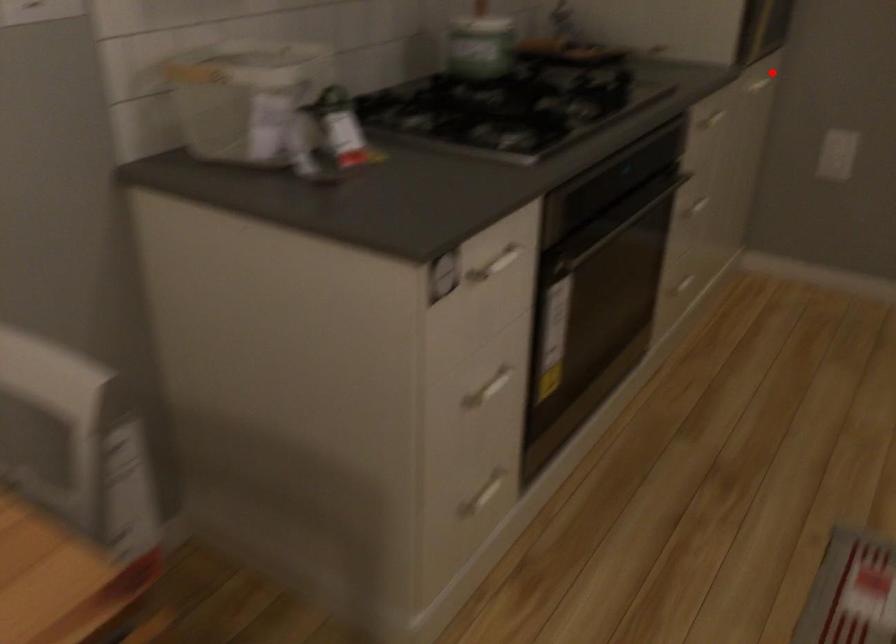
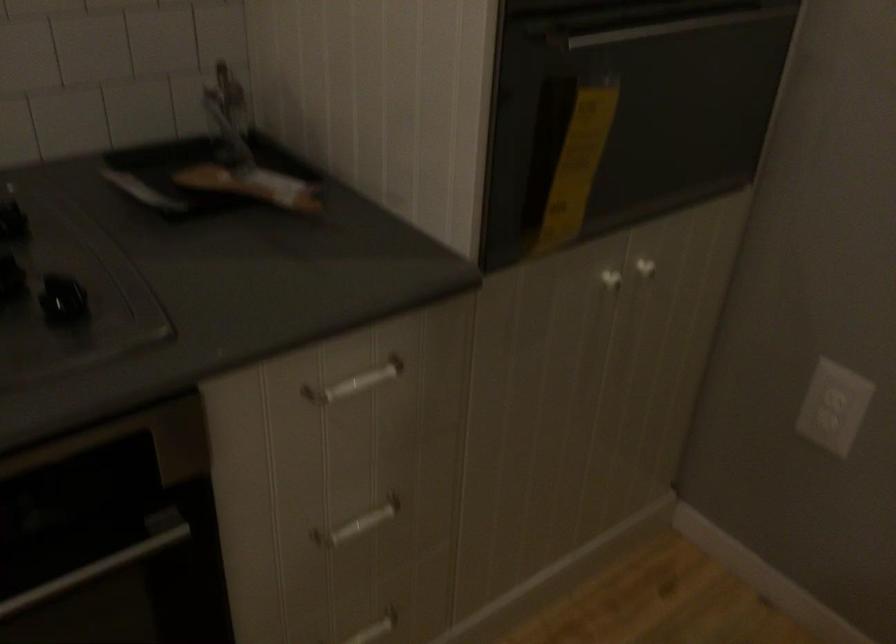
Question: I am providing you with two images of the same scene from different viewpoints. In image1, a red point is highlighted. Considering the same 3D point in image2, which of the following is correct?

Choices:
 (A) It is closer
 (B) It is farther

Answer: (A)